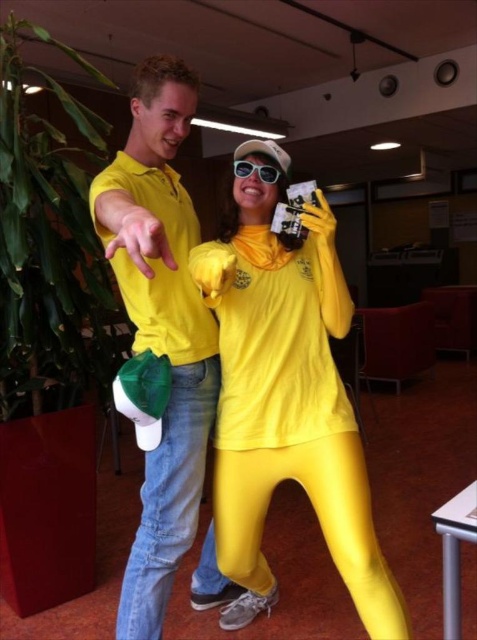
Question: Observing the image, what is the correct spatial positioning of matte yellow jumpsuit at center in reference to matte yellow shirt at left?

Choices:
 (A) above
 (B) below

Answer: (B)

Question: Which point is closer to the camera taking this photo?

Choices:
 (A) (278, 330)
 (B) (269, 182)
 (C) (159, 243)

Answer: (C)

Question: Which object is the closest to the matte yellow shirt at left?

Choices:
 (A) sunglasses at center
 (B) matte yellow jumpsuit at center

Answer: (B)

Question: Which point is closer to the camera taking this photo?

Choices:
 (A) (256, 168)
 (B) (158, 534)
 (C) (273, 372)

Answer: (C)

Question: Is matte yellow jumpsuit at center closer to camera compared to sunglasses at center?

Choices:
 (A) no
 (B) yes

Answer: (B)

Question: Can you confirm if matte yellow shirt at left is smaller than sunglasses at center?

Choices:
 (A) yes
 (B) no

Answer: (B)